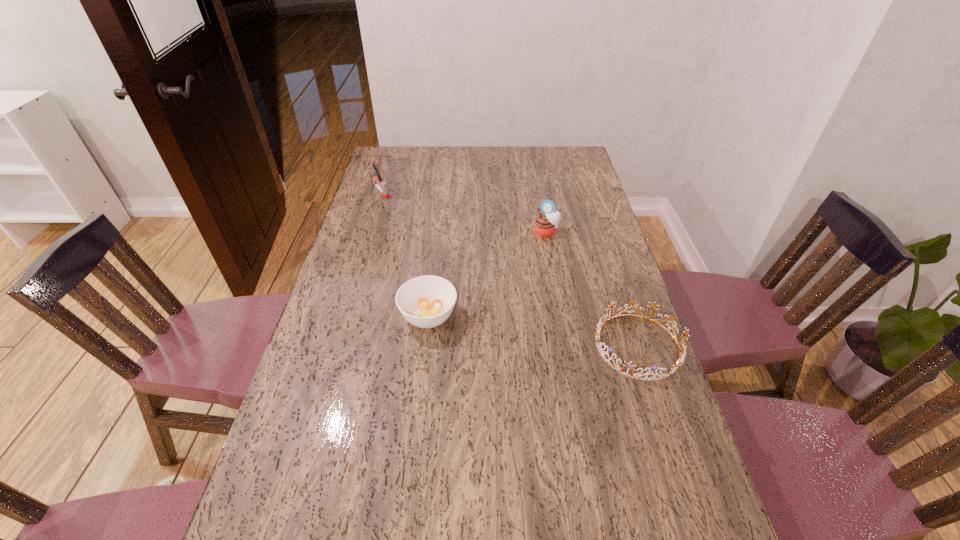
Find the location of a particular element. The height and width of the screenshot is (540, 960). free space on the desktop that is between the third object from right to left and the tiara and is positioned on the front-facing side of the tallest object is located at coordinates (522, 329).

At what (x,y) coordinates should I click in order to perform the action: click on free space on the desktop that is between the soup bowl and the tiara and is positioned on the handle side of the third shortest object. Please return your answer as a coordinate pair (x, y). Looking at the image, I should click on (513, 328).